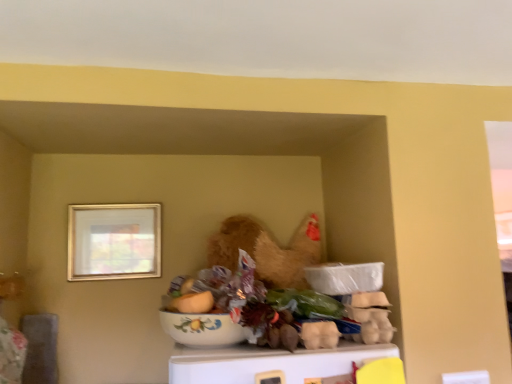
Describe the element at coordinates (114, 241) in the screenshot. Image resolution: width=512 pixels, height=384 pixels. I see `gold metallic picture frame at upper left` at that location.

I want to click on white glossy bowl at center, so click(x=202, y=329).

Is gold metallic picture frame at upper left to the left of white cardboard egg carton at center, positioned as the first food in bottom-to-top order, from the viewer's perspective?

Yes, gold metallic picture frame at upper left is to the left of white cardboard egg carton at center, positioned as the first food in bottom-to-top order.

From a real-world perspective, is gold metallic picture frame at upper left positioned above or below white cardboard egg carton at center, which is the 1th food from right to left?

Clearly, from a real-world perspective, gold metallic picture frame at upper left is above white cardboard egg carton at center, which is the 1th food from right to left.

How far apart are gold metallic picture frame at upper left and white cardboard egg carton at center, positioned as the second food in left-to-right order?

gold metallic picture frame at upper left is 34.62 inches from white cardboard egg carton at center, positioned as the second food in left-to-right order.

From the image's perspective, is gold metallic picture frame at upper left below white cardboard egg carton at center, positioned as the first food in bottom-to-top order?

No.

You are a GUI agent. You are given a task and a screenshot of the screen. Output one action in this format:
    pyautogui.click(x=<x>, y=<y>)
    Task: Click on the food lying in front of the white cardboard egg carton at center, which is the 1th food from right to left
    
    Given the screenshot: What is the action you would take?
    pyautogui.click(x=192, y=302)

Is the depth of floral ceramic bowl at center, the 2th food in the bottom-to-top sequence, greater than that of white cardboard egg carton at center, positioned as the second food in left-to-right order?

No, floral ceramic bowl at center, the 2th food in the bottom-to-top sequence, is closer to the viewer.

Who is taller, floral ceramic bowl at center, the 2th food in the bottom-to-top sequence, or white cardboard egg carton at center, positioned as the first food in bottom-to-top order?

floral ceramic bowl at center, the 2th food in the bottom-to-top sequence.

Does point (195, 302) appear closer or farther from the camera than point (323, 331)?

Point (195, 302) appears to be farther away from the viewer than point (323, 331).

Can you confirm if floral ceramic bowl at center, which is the second food from right to left, is positioned to the left of white glossy bowl at center?

Correct, you'll find floral ceramic bowl at center, which is the second food from right to left, to the left of white glossy bowl at center.

Is floral ceramic bowl at center, which is the second food from right to left, outside of white glossy bowl at center?

No.

Can you tell me how much floral ceramic bowl at center, which ranks as the first food in top-to-bottom order, and white glossy bowl at center differ in facing direction?

floral ceramic bowl at center, which ranks as the first food in top-to-bottom order, and white glossy bowl at center are facing 0.00032 degrees away from each other.

Is the surface of floral ceramic bowl at center, which ranks as the first food in top-to-bottom order, in direct contact with white glossy bowl at center?

Yes, floral ceramic bowl at center, which ranks as the first food in top-to-bottom order, is right next to white glossy bowl at center and making contact.

Which is more to the left, white glossy bowl at center or white cardboard egg carton at center, positioned as the first food in bottom-to-top order?

Positioned to the left is white glossy bowl at center.

Is white glossy bowl at center bigger than white cardboard egg carton at center, positioned as the first food in bottom-to-top order?

Yes.

How different are the orientations of white glossy bowl at center and white cardboard egg carton at center, the 2th food in the top-to-bottom sequence, in degrees?

There is a 0.00134-degree angle between the facing directions of white glossy bowl at center and white cardboard egg carton at center, the 2th food in the top-to-bottom sequence.

Is white cardboard egg carton at center, the 2th food in the top-to-bottom sequence, thinner than floral ceramic bowl at center, the 2th food in the bottom-to-top sequence?

Incorrect, the width of white cardboard egg carton at center, the 2th food in the top-to-bottom sequence, is not less than that of floral ceramic bowl at center, the 2th food in the bottom-to-top sequence.

From a real-world perspective, is white cardboard egg carton at center, which is the 1th food from right to left, positioned above or below floral ceramic bowl at center, which is the second food from right to left?

In terms of real-world spatial position, white cardboard egg carton at center, which is the 1th food from right to left, is below floral ceramic bowl at center, which is the second food from right to left.

Is white glossy bowl at center at the left side of gold metallic picture frame at upper left?

No.

Which of these two, white glossy bowl at center or gold metallic picture frame at upper left, is wider?

With larger width is white glossy bowl at center.

Measure the distance from white glossy bowl at center to gold metallic picture frame at upper left.

white glossy bowl at center and gold metallic picture frame at upper left are 22.60 inches apart.

Locate an element on the screen. The image size is (512, 384). picture frame above the white glossy bowl at center (from a real-world perspective) is located at coordinates (114, 241).

From the gold metallic picture frame at upper left, count 1st food to the right and point to it. Please provide its 2D coordinates.

[(192, 302)]

Who is smaller, floral ceramic bowl at center, which ranks as the first food in top-to-bottom order, or gold metallic picture frame at upper left?

With smaller size is floral ceramic bowl at center, which ranks as the first food in top-to-bottom order.

From the image's perspective, which one is positioned lower, floral ceramic bowl at center, which is the first food in left-to-right order, or gold metallic picture frame at upper left?

floral ceramic bowl at center, which is the first food in left-to-right order, is shown below in the image.

At what (x,y) coordinates should I click in order to perform the action: click on the 2nd food below when counting from the gold metallic picture frame at upper left (from the image's perspective). Please return your answer as a coordinate pair (x, y). Looking at the image, I should click on (319, 334).

Identify the location of food on the left side of white cardboard egg carton at center, the 2th food in the top-to-bottom sequence. (192, 302).

When comparing their distances from white cardboard egg carton at center, positioned as the second food in left-to-right order, does gold metallic picture frame at upper left or white glossy bowl at center seem closer?

white glossy bowl at center is positioned closer to the anchor white cardboard egg carton at center, positioned as the second food in left-to-right order.

From the image, which object appears to be farther from floral ceramic bowl at center, which is the second food from right to left, white cardboard egg carton at center, which is the 1th food from right to left, or white glossy bowl at center?

white cardboard egg carton at center, which is the 1th food from right to left, is positioned further to the anchor floral ceramic bowl at center, which is the second food from right to left.

Looking at the image, which one is located further to white glossy bowl at center, floral ceramic bowl at center, which is the first food in left-to-right order, or white cardboard egg carton at center, positioned as the second food in left-to-right order?

white cardboard egg carton at center, positioned as the second food in left-to-right order, lies further to white glossy bowl at center than the other object.

Looking at the image, which one is located further to white cardboard egg carton at center, positioned as the first food in bottom-to-top order, white glossy bowl at center or floral ceramic bowl at center, which is the second food from right to left?

Based on the image, floral ceramic bowl at center, which is the second food from right to left, appears to be further to white cardboard egg carton at center, positioned as the first food in bottom-to-top order.

Which object lies nearer to the anchor point gold metallic picture frame at upper left, white cardboard egg carton at center, positioned as the first food in bottom-to-top order, or white glossy bowl at center?

white glossy bowl at center.

Looking at the image, which one is located further to floral ceramic bowl at center, which is the first food in left-to-right order, gold metallic picture frame at upper left or white cardboard egg carton at center, positioned as the second food in left-to-right order?

gold metallic picture frame at upper left.

Looking at the image, which one is located further to gold metallic picture frame at upper left, floral ceramic bowl at center, which is the first food in left-to-right order, or white cardboard egg carton at center, positioned as the second food in left-to-right order?

Based on the image, white cardboard egg carton at center, positioned as the second food in left-to-right order, appears to be further to gold metallic picture frame at upper left.

When comparing their distances from gold metallic picture frame at upper left, does white glossy bowl at center or floral ceramic bowl at center, the 2th food in the bottom-to-top sequence, seem closer?

Based on the image, white glossy bowl at center appears to be nearer to gold metallic picture frame at upper left.

Locate an element on the screen. food located between gold metallic picture frame at upper left and white cardboard egg carton at center, the 2th food in the top-to-bottom sequence, in the left-right direction is located at coordinates (192, 302).

The height and width of the screenshot is (384, 512). In order to click on bowl located between gold metallic picture frame at upper left and white cardboard egg carton at center, positioned as the first food in bottom-to-top order, in the left-right direction in this screenshot , I will do `click(202, 329)`.

This screenshot has width=512, height=384. In order to click on bowl situated between floral ceramic bowl at center, which ranks as the first food in top-to-bottom order, and white cardboard egg carton at center, positioned as the second food in left-to-right order, from left to right in this screenshot , I will do (x=202, y=329).